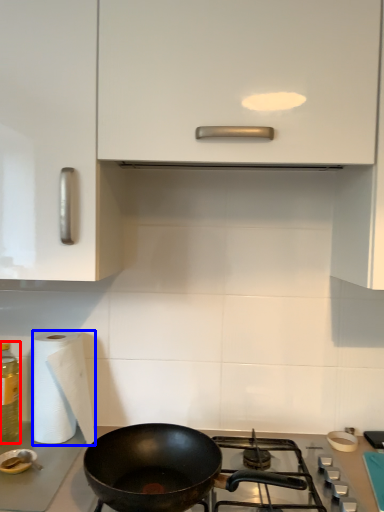
Question: Which of the following is the farthest to the observer, bottle (highlighted by a red box) or paper towel (highlighted by a blue box)?

Choices:
 (A) bottle
 (B) paper towel

Answer: (A)